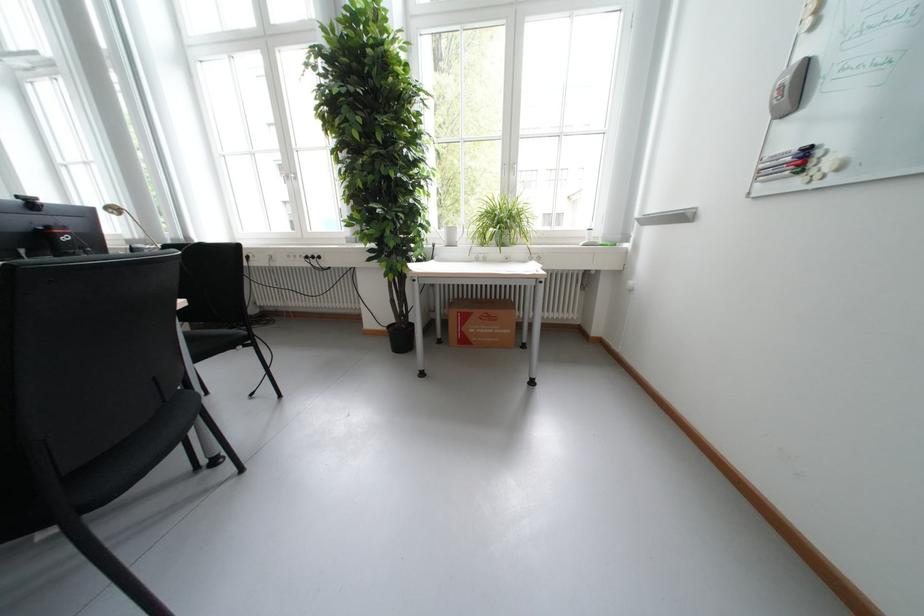
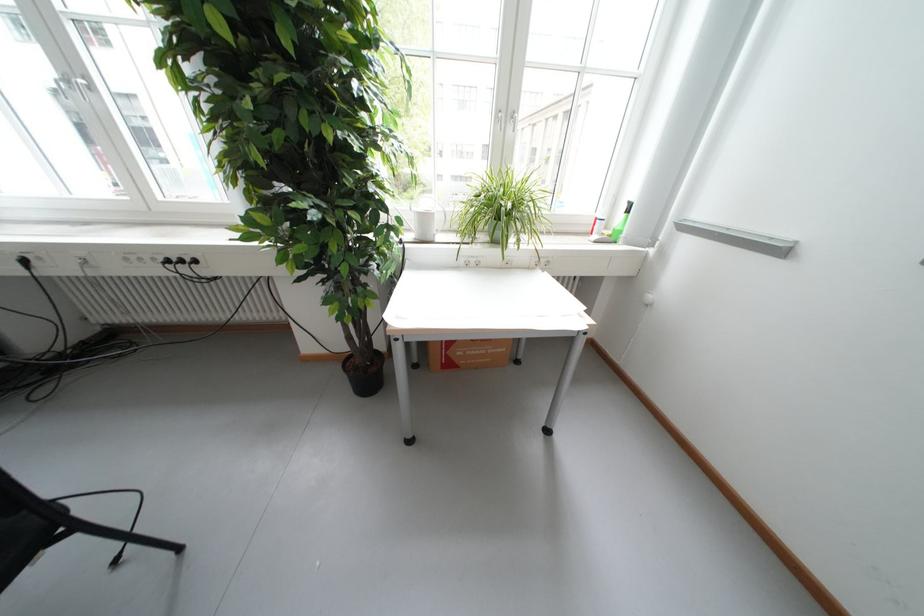
In the second image, find the point that corresponds to point 460,233 in the first image.

(435, 220)